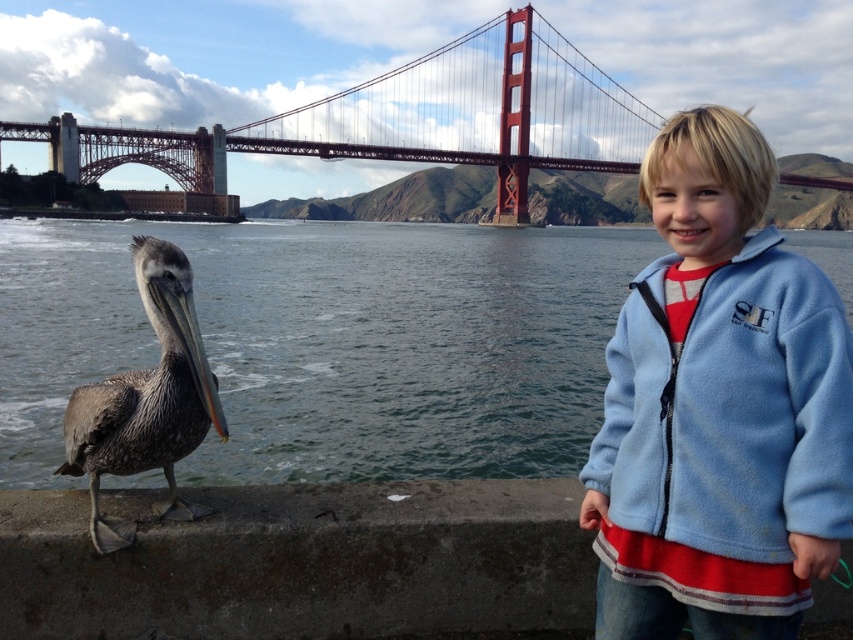
The image size is (853, 640). What do you see at coordinates (329, 342) in the screenshot?
I see `clear water at lower left` at bounding box center [329, 342].

Can you confirm if clear water at lower left is shorter than metallic red bridge at upper center?

Correct, clear water at lower left is not as tall as metallic red bridge at upper center.

I want to click on clear water at lower left, so click(329, 342).

Which is above, blue fleece jacket at right or brown feathered pelican at lower left?

blue fleece jacket at right is above.

In the scene shown: Does blue fleece jacket at right appear over brown feathered pelican at lower left?

Indeed, blue fleece jacket at right is positioned over brown feathered pelican at lower left.

Is point (741, 496) positioned before point (74, 403)?

That is True.

Locate an element on the screen. blue fleece jacket at right is located at coordinates (718, 406).

In the scene shown: Is blue fleece jacket at right thinner than metallic red bridge at upper center?

Yes.

The width and height of the screenshot is (853, 640). In order to click on blue fleece jacket at right in this screenshot , I will do `click(718, 406)`.

You are a GUI agent. You are given a task and a screenshot of the screen. Output one action in this format:
    pyautogui.click(x=<x>, y=<y>)
    Task: Click on the blue fleece jacket at right
    
    Given the screenshot: What is the action you would take?
    pyautogui.click(x=718, y=406)